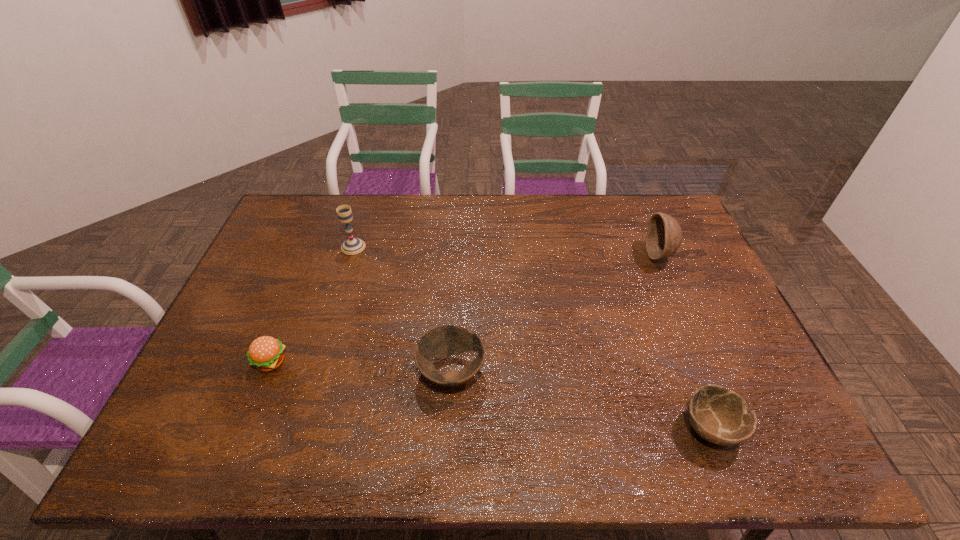
What are the coordinates of `empty location between the farthest bowl and the hamburger` in the screenshot? It's located at (465, 308).

Identify the location of free space between the farthest bowl and the leftmost object. The image size is (960, 540). (465, 308).

Find the location of a particular element. The width and height of the screenshot is (960, 540). unoccupied area between the shortest bowl and the second object from left to right is located at coordinates (532, 337).

Locate an element on the screen. This screenshot has width=960, height=540. vacant space that's between the leftmost object and the second object from left to right is located at coordinates (312, 304).

Image resolution: width=960 pixels, height=540 pixels. Identify the location of free space between the farthest bowl and the leftmost bowl. (556, 314).

Where is `vacant space that is in between the leftmost object and the leftmost bowl`? Image resolution: width=960 pixels, height=540 pixels. vacant space that is in between the leftmost object and the leftmost bowl is located at coordinates (361, 367).

Where is `empty space that is in between the leftmost bowl and the farthest bowl`? empty space that is in between the leftmost bowl and the farthest bowl is located at coordinates (556, 314).

The height and width of the screenshot is (540, 960). What are the coordinates of `vacant space that is in between the leftmost bowl and the shortest bowl` in the screenshot? It's located at (582, 400).

Locate an element on the screen. Image resolution: width=960 pixels, height=540 pixels. the third closest object to the leftmost object is located at coordinates (720, 416).

The height and width of the screenshot is (540, 960). Find the location of `the third closest object to the leftmost bowl`. the third closest object to the leftmost bowl is located at coordinates (720, 416).